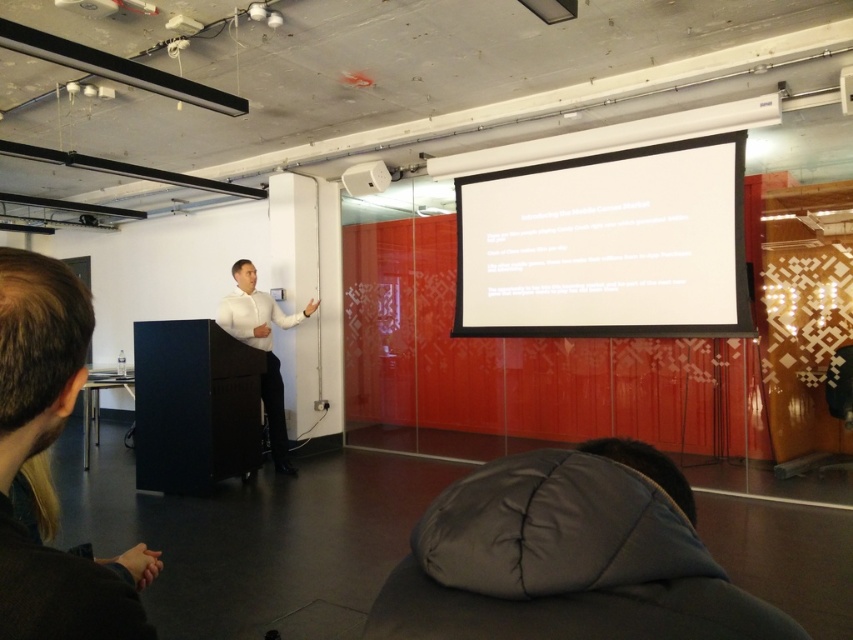
Question: Which of the following is the closest to the observer?

Choices:
 (A) (641, 275)
 (B) (346, 189)
 (C) (234, 275)

Answer: (A)

Question: Is white matte projection screen at upper center further to the viewer compared to white glossy shirt at center?

Choices:
 (A) yes
 (B) no

Answer: (B)

Question: Which point appears closest to the camera in this image?

Choices:
 (A) (277, 310)
 (B) (56, 428)
 (C) (596, 186)
 (D) (373, 161)

Answer: (B)

Question: Can you confirm if white matte projection screen at upper center is positioned to the right of white glossy shirt at center?

Choices:
 (A) no
 (B) yes

Answer: (B)

Question: Does dark brown leather jacket at lower left have a greater width compared to white plastic speaker at upper center?

Choices:
 (A) yes
 (B) no

Answer: (A)

Question: Estimate the real-world distances between objects in this image. Which object is closer to the dark brown leather jacket at lower left?

Choices:
 (A) white matte projection screen at upper center
 (B) white plastic speaker at upper center
 (C) white glossy shirt at center

Answer: (C)